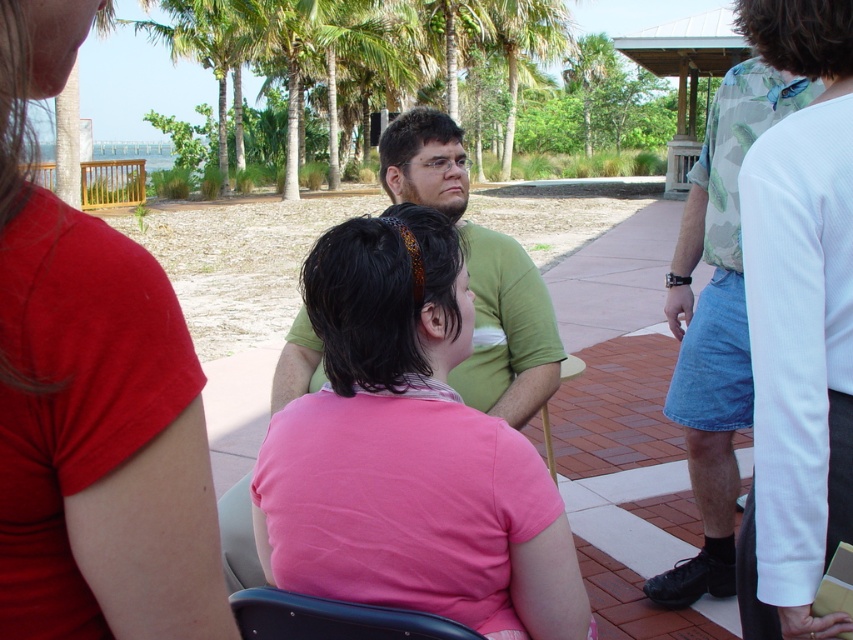
You are standing at the edge of the walkway and want to sit down on the black plastic chair at lower center. There is a person in a matte pink shirt at center blocking your path. Can you walk around them to reach the chair?

The matte pink shirt at center is closer to the viewer than the black plastic chair at lower center, so you can walk around them to reach the chair since they are in front of it.

Looking at this image, you are standing in the park scene and want to greet both the matte pink shirt at center and the camouflage shirt at right. If you start from the left side of the scene, which person should you approach first?

You should approach the matte pink shirt at center first because it is located to the left of the camouflage shirt at right.